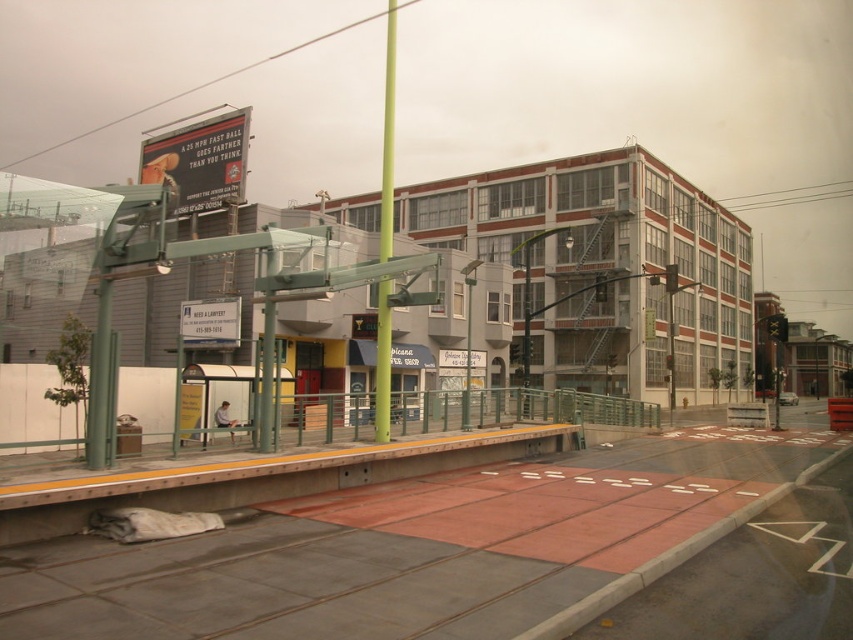
Can you confirm if red rubber train track at lower center is smaller than green matte pole at center?

Indeed, red rubber train track at lower center has a smaller size compared to green matte pole at center.

Which is more to the left, red rubber train track at lower center or green matte pole at center?

From the viewer's perspective, green matte pole at center appears more on the left side.

Where is `red rubber train track at lower center`? The height and width of the screenshot is (640, 853). red rubber train track at lower center is located at coordinates (404, 552).